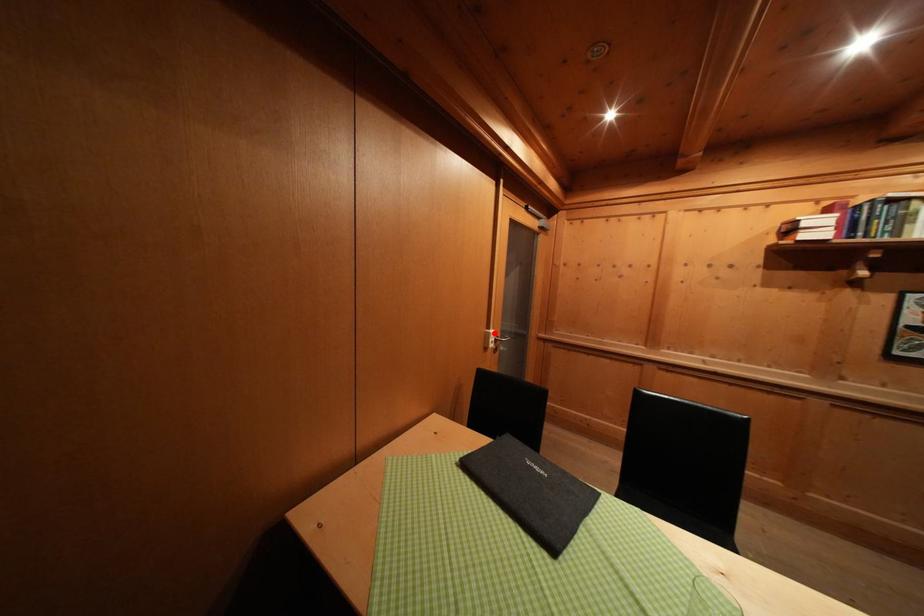
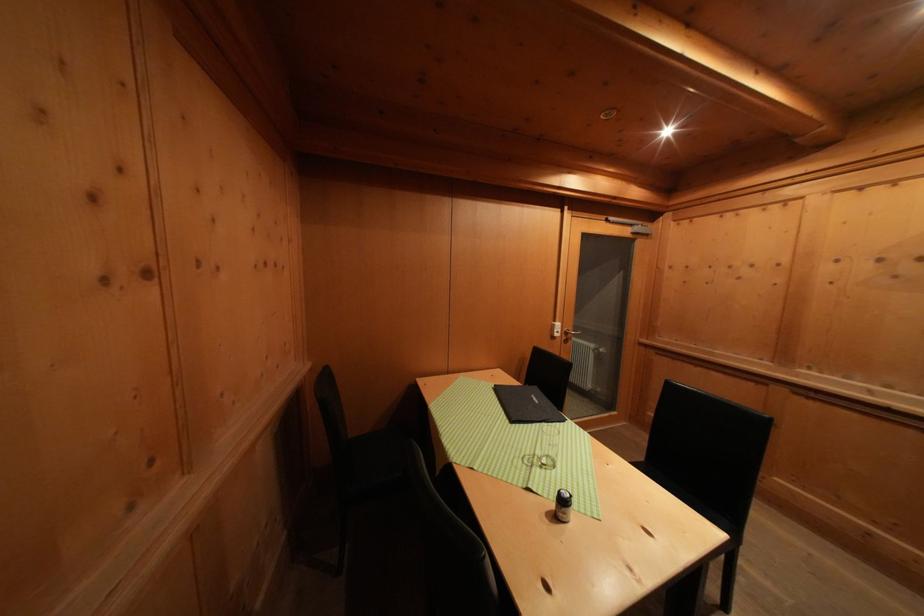
Find the pixel in the second image that matches the highlighted location in the first image.

(561, 326)